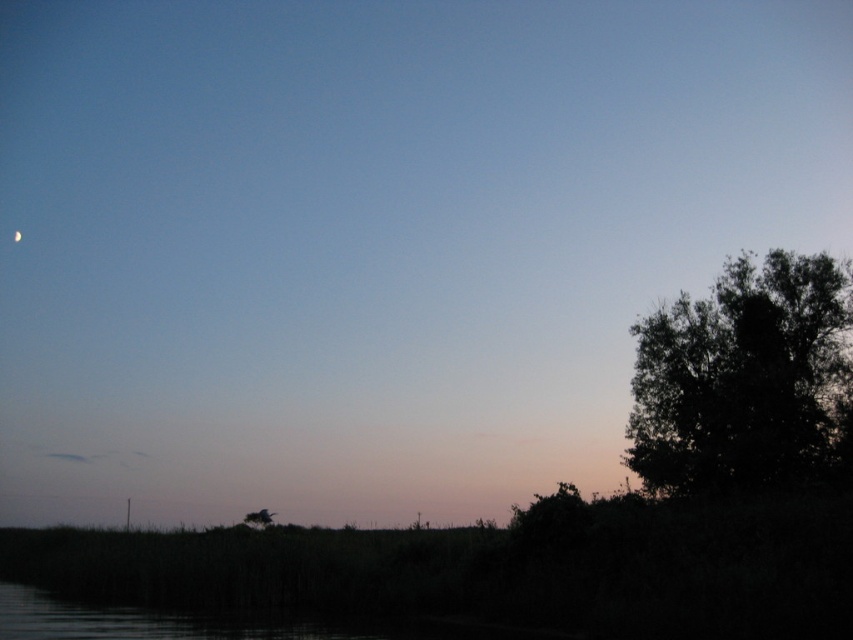
Question: Which point is farther to the camera?

Choices:
 (A) dark green leafy tree at right
 (B) silver metallic moon at upper left

Answer: (B)

Question: Is dark green leafy tree at right to the right of silver metallic moon at upper left from the viewer's perspective?

Choices:
 (A) yes
 (B) no

Answer: (A)

Question: In this image, where is dark green leafy tree at right located relative to silver metallic moon at upper left?

Choices:
 (A) left
 (B) right

Answer: (B)

Question: Can you confirm if dark green leafy tree at right is bigger than silver metallic moon at upper left?

Choices:
 (A) no
 (B) yes

Answer: (B)